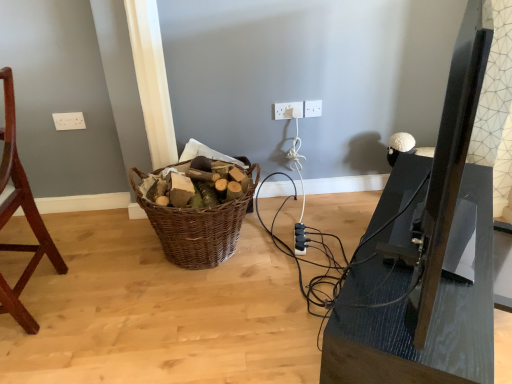
What do you see at coordinates (288, 110) in the screenshot?
I see `white plastic electric outlet at center, which is the 2th electric outlet from left to right` at bounding box center [288, 110].

What do you see at coordinates (300, 239) in the screenshot?
I see `black plastic extension cord at lower center` at bounding box center [300, 239].

What do you see at coordinates (24, 213) in the screenshot?
I see `mahogany wood chair at left` at bounding box center [24, 213].

This screenshot has height=384, width=512. What are the coordinates of `white plastic electric outlet at upper center, which is the third electric outlet in right-to-left order` in the screenshot? It's located at (69, 121).

Where is `white plastic electric outlet at center, arranged as the 2th electric outlet when viewed from the right`? Image resolution: width=512 pixels, height=384 pixels. white plastic electric outlet at center, arranged as the 2th electric outlet when viewed from the right is located at coordinates (288, 110).

Image resolution: width=512 pixels, height=384 pixels. In order to click on table in front of the white plastic electric outlet at center, which is the 2th electric outlet from left to right in this screenshot , I will do `click(431, 316)`.

Do you think matte black tv stand at right is within white plastic electric outlet at center, arranged as the 2th electric outlet when viewed from the right, or outside of it?

matte black tv stand at right is not inside white plastic electric outlet at center, arranged as the 2th electric outlet when viewed from the right, it's outside.

From a real-world perspective, which object stands above the other?

In real-world perspective, white plastic electric outlet at center, arranged as the 2th electric outlet when viewed from the right, is above.

Is white plastic electric outlet at upper center, placed as the first electric outlet when sorted from right to left, far away from white plastic electric outlet at upper center, which is the third electric outlet in right-to-left order?

Yes, white plastic electric outlet at upper center, placed as the first electric outlet when sorted from right to left, is far from white plastic electric outlet at upper center, which is the third electric outlet in right-to-left order.

Is white plastic electric outlet at upper center, placed as the first electric outlet when sorted from right to left, completely or partially outside of white plastic electric outlet at upper center, which is the third electric outlet in right-to-left order?

Indeed, white plastic electric outlet at upper center, placed as the first electric outlet when sorted from right to left, is completely outside white plastic electric outlet at upper center, which is the third electric outlet in right-to-left order.

Is white plastic electric outlet at upper center, acting as the 3th electric outlet starting from the left, taller or shorter than white plastic electric outlet at upper center, placed as the first electric outlet when sorted from left to right?

Considering their sizes, white plastic electric outlet at upper center, acting as the 3th electric outlet starting from the left, has more height than white plastic electric outlet at upper center, placed as the first electric outlet when sorted from left to right.

Which object is thinner, white plastic electric outlet at center, arranged as the 2th electric outlet when viewed from the right, or mahogany wood chair at left?

white plastic electric outlet at center, arranged as the 2th electric outlet when viewed from the right.

How much distance is there between white plastic electric outlet at center, which is the 2th electric outlet from left to right, and mahogany wood chair at left?

white plastic electric outlet at center, which is the 2th electric outlet from left to right, and mahogany wood chair at left are 1.28 meters apart from each other.

Is mahogany wood chair at left surrounded by white plastic electric outlet at center, which is the 2th electric outlet from left to right?

No.

What are the coordinates of `chair on the left of white plastic electric outlet at center, arranged as the 2th electric outlet when viewed from the right` in the screenshot? It's located at (24, 213).

Is matte black tv stand at right positioned with its back to white plastic electric outlet at upper center, which is the third electric outlet in right-to-left order?

Yes, matte black tv stand at right's orientation is away from white plastic electric outlet at upper center, which is the third electric outlet in right-to-left order.

How many degrees apart are the facing directions of matte black tv stand at right and white plastic electric outlet at upper center, placed as the first electric outlet when sorted from left to right?

They differ by 59.8 degrees in their facing directions.

Does matte black tv stand at right have a larger size compared to white plastic electric outlet at upper center, which is the third electric outlet in right-to-left order?

Yes.

Is matte black tv stand at right touching white plastic electric outlet at upper center, which is the third electric outlet in right-to-left order?

No, matte black tv stand at right is not beside white plastic electric outlet at upper center, which is the third electric outlet in right-to-left order.

From the picture: Is black plastic extension cord at lower center placed right next to mahogany wood chair at left?

No, black plastic extension cord at lower center is not next to mahogany wood chair at left.

Is black plastic extension cord at lower center oriented away from mahogany wood chair at left?

No, black plastic extension cord at lower center is not facing the opposite direction of mahogany wood chair at left.

Is point (295, 229) farther from viewer compared to point (38, 231)?

Yes, point (295, 229) is behind point (38, 231).

Is black plastic extension cord at lower center bigger than mahogany wood chair at left?

Incorrect, black plastic extension cord at lower center is not larger than mahogany wood chair at left.

Between white plastic electric outlet at center, arranged as the 2th electric outlet when viewed from the right, and matte black tv stand at right, which one appears on the left side from the viewer's perspective?

Positioned to the left is white plastic electric outlet at center, arranged as the 2th electric outlet when viewed from the right.

Is matte black tv stand at right at the back of white plastic electric outlet at center, which is the 2th electric outlet from left to right?

That's not correct — white plastic electric outlet at center, which is the 2th electric outlet from left to right, is not looking away from matte black tv stand at right.

Is white plastic electric outlet at center, which is the 2th electric outlet from left to right, wider or thinner than matte black tv stand at right?

Considering their sizes, white plastic electric outlet at center, which is the 2th electric outlet from left to right, looks slimmer than matte black tv stand at right.

Is point (277, 118) closer or farther from the camera than point (434, 372)?

Point (277, 118) is farther from the camera than point (434, 372).

In the scene shown: Is there a large distance between white plastic electric outlet at upper center, acting as the 3th electric outlet starting from the left, and black plastic extension cord at lower center?

Actually, white plastic electric outlet at upper center, acting as the 3th electric outlet starting from the left, and black plastic extension cord at lower center are a little close together.

In the scene shown: Considering the relative sizes of white plastic electric outlet at upper center, placed as the first electric outlet when sorted from right to left, and black plastic extension cord at lower center in the image provided, is white plastic electric outlet at upper center, placed as the first electric outlet when sorted from right to left, shorter than black plastic extension cord at lower center?

No.

From a real-world perspective, is white plastic electric outlet at upper center, placed as the first electric outlet when sorted from right to left, above or below black plastic extension cord at lower center?

In terms of real-world spatial position, white plastic electric outlet at upper center, placed as the first electric outlet when sorted from right to left, is above black plastic extension cord at lower center.

Considering the relative sizes of white plastic electric outlet at upper center, acting as the 3th electric outlet starting from the left, and black plastic extension cord at lower center in the image provided, is white plastic electric outlet at upper center, acting as the 3th electric outlet starting from the left, smaller than black plastic extension cord at lower center?

Indeed, white plastic electric outlet at upper center, acting as the 3th electric outlet starting from the left, has a smaller size compared to black plastic extension cord at lower center.

I want to click on table below the white plastic electric outlet at center, arranged as the 2th electric outlet when viewed from the right (from a real-world perspective), so click(x=431, y=316).

Locate an element on the screen. electric outlet above the white plastic electric outlet at upper center, placed as the first electric outlet when sorted from right to left (from a real-world perspective) is located at coordinates (69, 121).

Considering their positions, is white plastic electric outlet at center, arranged as the 2th electric outlet when viewed from the right, positioned closer to woven brown basket at center than black plastic extension cord at lower center?

black plastic extension cord at lower center lies closer to woven brown basket at center than the other object.

Based on their spatial positions, is mahogany wood chair at left or woven brown basket at center further from matte black tv stand at right?

mahogany wood chair at left lies further to matte black tv stand at right than the other object.

Considering their positions, is matte black tv stand at right positioned further to mahogany wood chair at left than woven brown basket at center?

The object further to mahogany wood chair at left is matte black tv stand at right.

Looking at the image, which one is located further to woven brown basket at center, matte black tv stand at right or white plastic electric outlet at upper center, placed as the first electric outlet when sorted from right to left?

Based on the image, white plastic electric outlet at upper center, placed as the first electric outlet when sorted from right to left, appears to be further to woven brown basket at center.

Looking at the image, which one is located closer to white plastic electric outlet at upper center, placed as the first electric outlet when sorted from left to right, white plastic electric outlet at center, which is the 2th electric outlet from left to right, or white plastic electric outlet at upper center, placed as the first electric outlet when sorted from right to left?

Among the two, white plastic electric outlet at center, which is the 2th electric outlet from left to right, is located nearer to white plastic electric outlet at upper center, placed as the first electric outlet when sorted from left to right.

When comparing their distances from mahogany wood chair at left, does white plastic electric outlet at center, arranged as the 2th electric outlet when viewed from the right, or white plastic electric outlet at upper center, which is the third electric outlet in right-to-left order, seem further?

white plastic electric outlet at center, arranged as the 2th electric outlet when viewed from the right, lies further to mahogany wood chair at left than the other object.

From the picture: Considering their positions, is white plastic electric outlet at upper center, placed as the first electric outlet when sorted from right to left, positioned closer to white plastic electric outlet at upper center, placed as the first electric outlet when sorted from left to right, than woven brown basket at center?

woven brown basket at center is positioned closer to the anchor white plastic electric outlet at upper center, placed as the first electric outlet when sorted from left to right.

When comparing their distances from matte black tv stand at right, does black plastic extension cord at lower center or white plastic electric outlet at upper center, placed as the first electric outlet when sorted from right to left, seem further?

The object further to matte black tv stand at right is white plastic electric outlet at upper center, placed as the first electric outlet when sorted from right to left.

Where is `extension cord between white plastic electric outlet at upper center, which is the third electric outlet in right-to-left order, and matte black tv stand at right`? The width and height of the screenshot is (512, 384). extension cord between white plastic electric outlet at upper center, which is the third electric outlet in right-to-left order, and matte black tv stand at right is located at coordinates (300, 239).

Identify the location of electric outlet between white plastic electric outlet at upper center, which is the third electric outlet in right-to-left order, and black plastic extension cord at lower center from left to right. (288, 110).

Locate an element on the screen. This screenshot has height=384, width=512. basket between matte black tv stand at right and black plastic extension cord at lower center along the z-axis is located at coordinates (198, 226).

Locate an element on the screen. extension cord between mahogany wood chair at left and matte black tv stand at right in the horizontal direction is located at coordinates (300, 239).